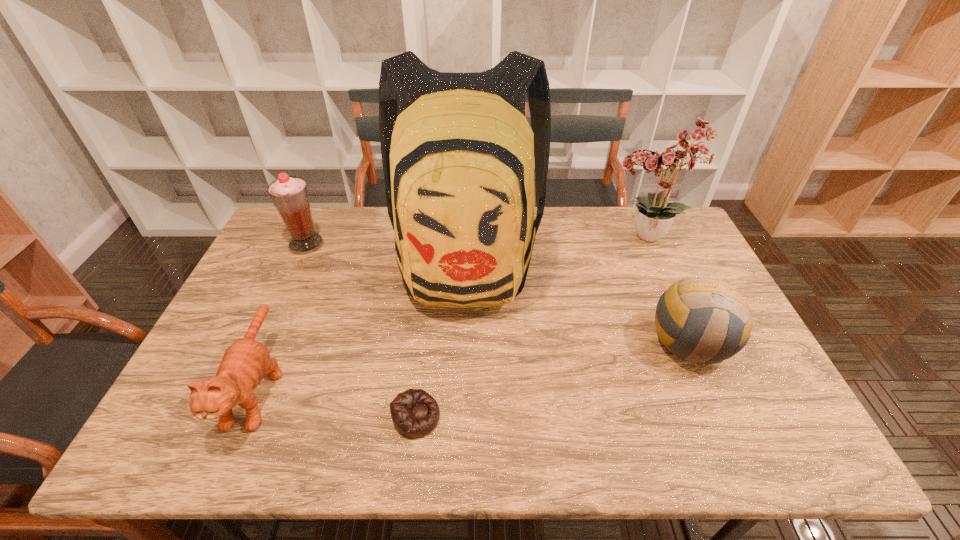
At what (x,y) coordinates should I click in order to perform the action: click on free space located 0.230m on the front of the fourth shortest object. Please return your answer as a coordinate pair (x, y). Looking at the image, I should click on (277, 306).

Locate an element on the screen. vacant area situated 0.120m on the back of the volleyball is located at coordinates (662, 281).

Image resolution: width=960 pixels, height=540 pixels. Find the location of `vacant space located on the left of the beanbag`. vacant space located on the left of the beanbag is located at coordinates (327, 417).

You are a GUI agent. You are given a task and a screenshot of the screen. Output one action in this format:
    pyautogui.click(x=<x>, y=<y>)
    Task: Click on the backpack located at the far edge
    This screenshot has height=540, width=960.
    Given the screenshot: What is the action you would take?
    pyautogui.click(x=458, y=153)

Identify the location of flower arrangement that is at the far edge. The image size is (960, 540). (654, 215).

This screenshot has width=960, height=540. Find the location of `smoothie located at the far edge`. smoothie located at the far edge is located at coordinates (289, 194).

At what (x,y) coordinates should I click in order to perform the action: click on cat at the near edge. Please return your answer as a coordinate pair (x, y). The height and width of the screenshot is (540, 960). Looking at the image, I should click on (245, 361).

Image resolution: width=960 pixels, height=540 pixels. Identify the location of beanbag that is at the near edge. (415, 413).

I want to click on smoothie situated at the left edge, so click(x=289, y=194).

Find the location of a particular element. cat positioned at the left edge is located at coordinates (245, 361).